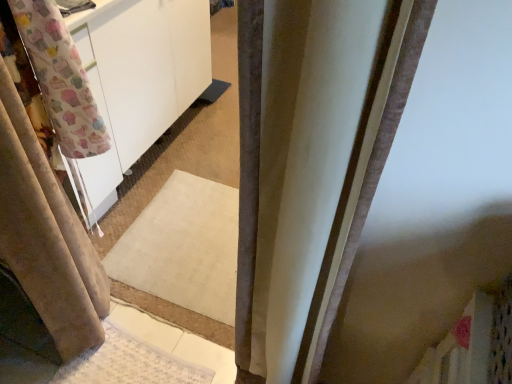
Question: Is satin beige curtain at center, which is counted as the second curtain, starting from the left, not inside beige fabric curtain at left, which ranks as the 2th curtain in right-to-left order?

Choices:
 (A) no
 (B) yes

Answer: (B)

Question: Is satin beige curtain at center, which is counted as the second curtain, starting from the left, directly adjacent to beige fabric curtain at left, arranged as the 1th curtain when viewed from the left?

Choices:
 (A) yes
 (B) no

Answer: (B)

Question: From the image's perspective, is satin beige curtain at center, the first curtain viewed from the right, beneath beige fabric curtain at left, arranged as the 1th curtain when viewed from the left?

Choices:
 (A) yes
 (B) no

Answer: (B)

Question: Is satin beige curtain at center, which is counted as the second curtain, starting from the left, at the right side of beige fabric curtain at left, which ranks as the 2th curtain in right-to-left order?

Choices:
 (A) yes
 (B) no

Answer: (A)

Question: Is satin beige curtain at center, the first curtain viewed from the right, thinner than beige fabric curtain at left, which ranks as the 2th curtain in right-to-left order?

Choices:
 (A) yes
 (B) no

Answer: (B)

Question: Is satin beige curtain at center, which is counted as the second curtain, starting from the left, closer to the viewer compared to beige fabric curtain at left, arranged as the 1th curtain when viewed from the left?

Choices:
 (A) no
 (B) yes

Answer: (B)

Question: Is beige fabric curtain at left, which ranks as the 2th curtain in right-to-left order, positioned beyond the bounds of satin beige curtain at center, which is counted as the second curtain, starting from the left?

Choices:
 (A) no
 (B) yes

Answer: (B)

Question: Is the surface of beige fabric curtain at left, which ranks as the 2th curtain in right-to-left order, in direct contact with satin beige curtain at center, the first curtain viewed from the right?

Choices:
 (A) no
 (B) yes

Answer: (A)

Question: Is beige fabric curtain at left, arranged as the 1th curtain when viewed from the left, thinner than satin beige curtain at center, the first curtain viewed from the right?

Choices:
 (A) no
 (B) yes

Answer: (B)

Question: Is beige fabric curtain at left, which ranks as the 2th curtain in right-to-left order, taller than satin beige curtain at center, which is counted as the second curtain, starting from the left?

Choices:
 (A) no
 (B) yes

Answer: (A)

Question: Is beige fabric curtain at left, arranged as the 1th curtain when viewed from the left, positioned behind satin beige curtain at center, the first curtain viewed from the right?

Choices:
 (A) yes
 (B) no

Answer: (A)

Question: Could you tell me if beige fabric curtain at left, arranged as the 1th curtain when viewed from the left, is turned towards satin beige curtain at center, the first curtain viewed from the right?

Choices:
 (A) no
 (B) yes

Answer: (A)

Question: In the image, is beige fabric curtain at left, which ranks as the 2th curtain in right-to-left order, on the left side or the right side of satin beige curtain at center, the first curtain viewed from the right?

Choices:
 (A) right
 (B) left

Answer: (B)